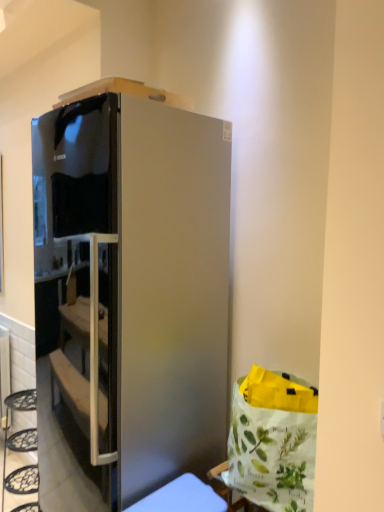
Question: From a real-world perspective, is satin silver refrigerator at center below satin silver fridge at lower center?

Choices:
 (A) yes
 (B) no

Answer: (B)

Question: From a real-world perspective, does satin silver refrigerator at center stand above satin silver fridge at lower center?

Choices:
 (A) yes
 (B) no

Answer: (A)

Question: Does satin silver refrigerator at center have a lesser height compared to satin silver fridge at lower center?

Choices:
 (A) yes
 (B) no

Answer: (B)

Question: Is the position of satin silver refrigerator at center more distant than that of satin silver fridge at lower center?

Choices:
 (A) yes
 (B) no

Answer: (A)

Question: Considering the relative sizes of satin silver refrigerator at center and satin silver fridge at lower center in the image provided, is satin silver refrigerator at center wider than satin silver fridge at lower center?

Choices:
 (A) no
 (B) yes

Answer: (B)

Question: Is satin silver refrigerator at center not inside satin silver fridge at lower center?

Choices:
 (A) yes
 (B) no

Answer: (A)

Question: Considering the relative sizes of satin silver fridge at lower center and satin silver refrigerator at center in the image provided, is satin silver fridge at lower center taller than satin silver refrigerator at center?

Choices:
 (A) no
 (B) yes

Answer: (A)

Question: Is satin silver fridge at lower center oriented away from satin silver refrigerator at center?

Choices:
 (A) no
 (B) yes

Answer: (A)

Question: Could you tell me if satin silver fridge at lower center is facing satin silver refrigerator at center?

Choices:
 (A) no
 (B) yes

Answer: (A)

Question: Is satin silver fridge at lower center at the left side of satin silver refrigerator at center?

Choices:
 (A) no
 (B) yes

Answer: (A)

Question: Is satin silver refrigerator at center surrounded by satin silver fridge at lower center?

Choices:
 (A) yes
 (B) no

Answer: (B)

Question: Can you confirm if satin silver fridge at lower center is thinner than satin silver refrigerator at center?

Choices:
 (A) no
 (B) yes

Answer: (B)

Question: From a real-world perspective, is satin silver refrigerator at center physically located above or below satin silver fridge at lower center?

Choices:
 (A) above
 (B) below

Answer: (A)